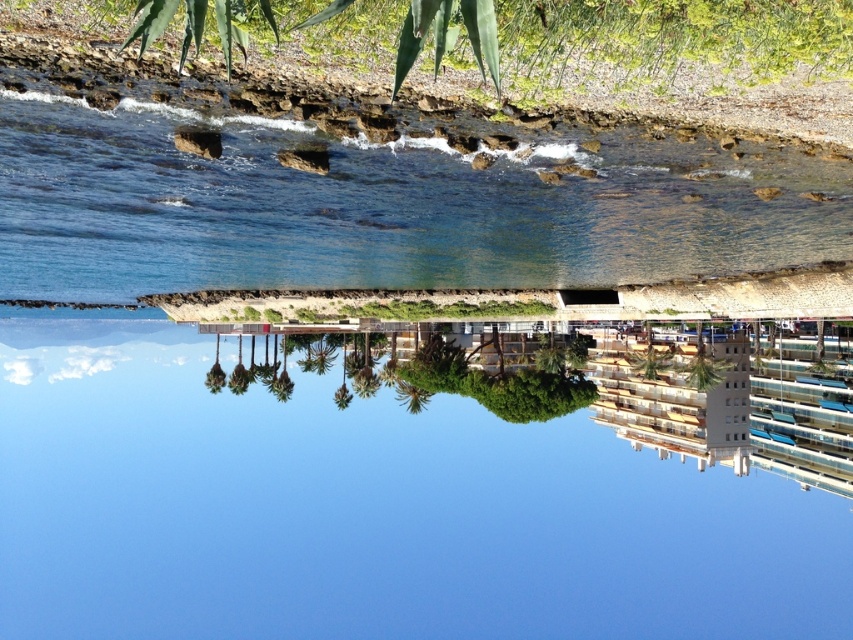
You are standing at the point marked as point (x=683, y=483). You want to walk to the nearest point on the rocky shoreline. How far will you have to walk?

The distance between the point (x=683, y=483) and the nearest point on the rocky shoreline is 184.40 meters, so you will have to walk 184.40 meters.

You are a photographer trying to capture the tallest object in the scene. Based on the image, which object between the blue glass river at center and the clear blue water at center should you focus on to ensure you capture the tallest one?

The blue glass river at center is taller than the clear blue water at center, so you should focus on the blue glass river at center to capture the tallest object.

You are standing at the point marked as point (367,504) in the rotated coastal landscape image. What is the nearest object to you?

The point (367,504) is located on the blue glass river at center, so the nearest object to you is the blue glass river at center.